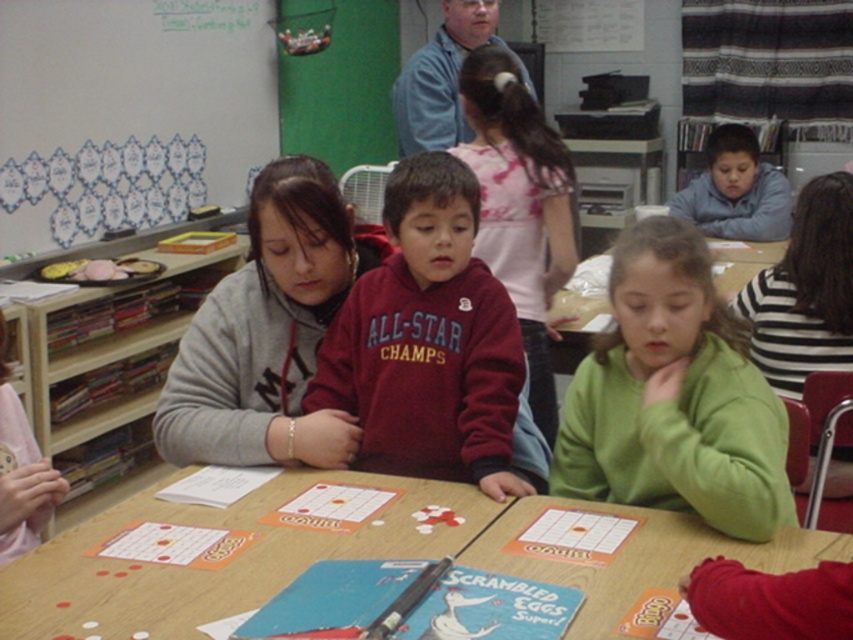
Question: Can you confirm if white paperboard at upper left is positioned above wooden table at center?

Choices:
 (A) no
 (B) yes

Answer: (B)

Question: Among these points, which one is farthest from the camera?

Choices:
 (A) (457, 92)
 (B) (715, 170)
 (C) (251, 577)
 (D) (427, 371)

Answer: (B)

Question: Estimate the real-world distances between objects in this image. Which object is farther from the white paperboard at upper left?

Choices:
 (A) blue cotton shirt at upper center
 (B) maroon fleece sweatshirt at center

Answer: (B)

Question: Is green matte sweatshirt at center to the left of blue fleece hoodie at upper right from the viewer's perspective?

Choices:
 (A) yes
 (B) no

Answer: (A)

Question: Which of these objects is positioned farthest from the maroon fleece sweatshirt at center?

Choices:
 (A) wooden table at center
 (B) white paperboard at upper left

Answer: (B)

Question: Considering the relative positions of maroon fleece sweatshirt at center and blue cotton shirt at upper center in the image provided, where is maroon fleece sweatshirt at center located with respect to blue cotton shirt at upper center?

Choices:
 (A) below
 (B) above

Answer: (A)